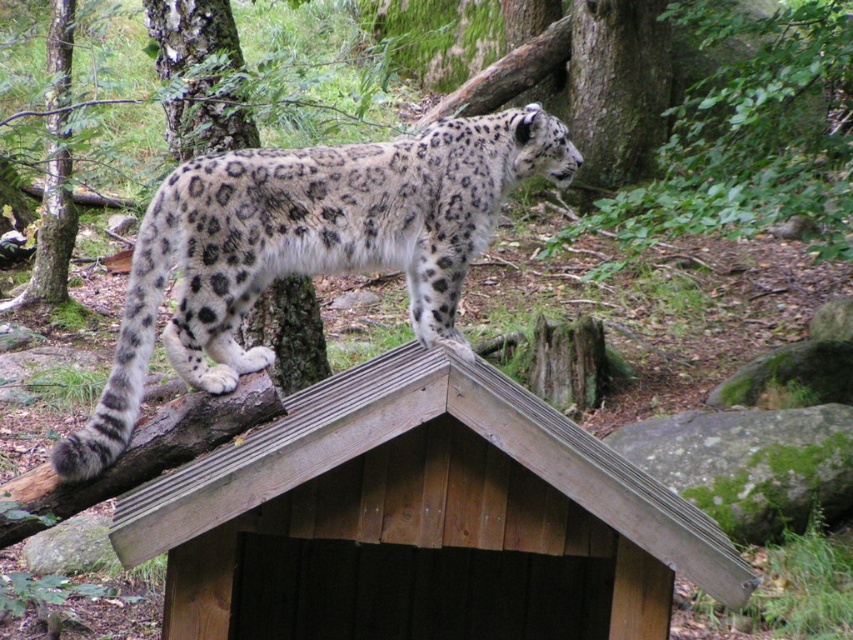
Question: Is brown wooden hut at upper center to the right of spotted fur leopard at center from the viewer's perspective?

Choices:
 (A) no
 (B) yes

Answer: (B)

Question: Which point is closer to the camera?

Choices:
 (A) (525, 417)
 (B) (496, 202)

Answer: (A)

Question: Is brown wooden hut at upper center to the right of spotted fur leopard at center from the viewer's perspective?

Choices:
 (A) yes
 (B) no

Answer: (A)

Question: Which of the following is the closest to the observer?

Choices:
 (A) (418, 461)
 (B) (511, 182)

Answer: (A)

Question: Does brown wooden hut at upper center have a larger size compared to spotted fur leopard at center?

Choices:
 (A) no
 (B) yes

Answer: (B)